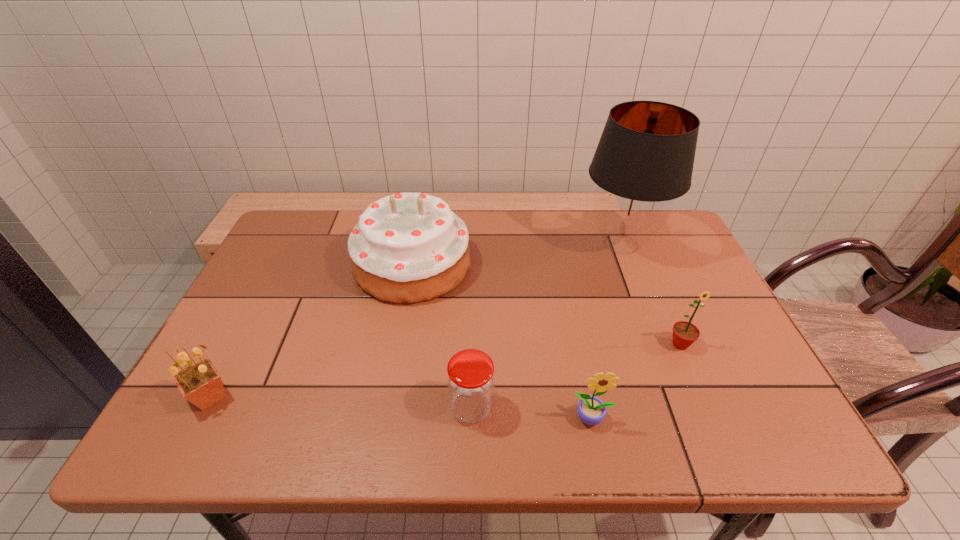
This screenshot has height=540, width=960. What are the coordinates of `free space between the lampshade and the leftmost sunflower` in the screenshot? It's located at (416, 320).

Identify the location of empty space between the rightmost sunflower and the fourth object from left to right. (636, 381).

Locate an element on the screen. This screenshot has height=540, width=960. unoccupied area between the second tallest object and the leftmost object is located at coordinates (311, 330).

Locate an element on the screen. This screenshot has width=960, height=540. vacant area between the shortest object and the rightmost sunflower is located at coordinates (576, 376).

Where is `vacant space that is in between the jar and the tallest object`? This screenshot has width=960, height=540. vacant space that is in between the jar and the tallest object is located at coordinates (546, 326).

Locate which object is the second closest to the rightmost sunflower. Please provide its 2D coordinates. Your answer should be formatted as a tuple, i.e. [(x, y)], where the tuple contains the x and y coordinates of a point satisfying the conditions above.

[(644, 159)]

Identify the location of object that stands as the fifth closest to the cake. This screenshot has height=540, width=960. (685, 333).

Select which sunflower is the second closest to the leftmost sunflower. Please provide its 2D coordinates. Your answer should be formatted as a tuple, i.e. [(x, y)], where the tuple contains the x and y coordinates of a point satisfying the conditions above.

[(685, 333)]

Point out which sunflower is positioned as the second nearest to the shortest object. Please provide its 2D coordinates. Your answer should be formatted as a tuple, i.e. [(x, y)], where the tuple contains the x and y coordinates of a point satisfying the conditions above.

[(685, 333)]

The width and height of the screenshot is (960, 540). I want to click on blank space that satisfies the following two spatial constraints: 1. on the front side of the cake; 2. at the front of the leftmost sunflower with flowers visible, so click(390, 396).